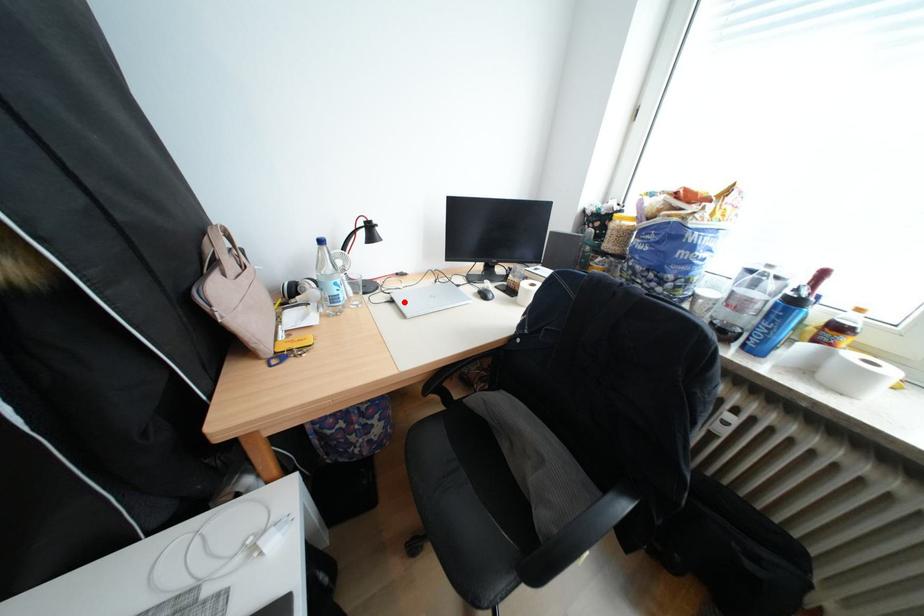
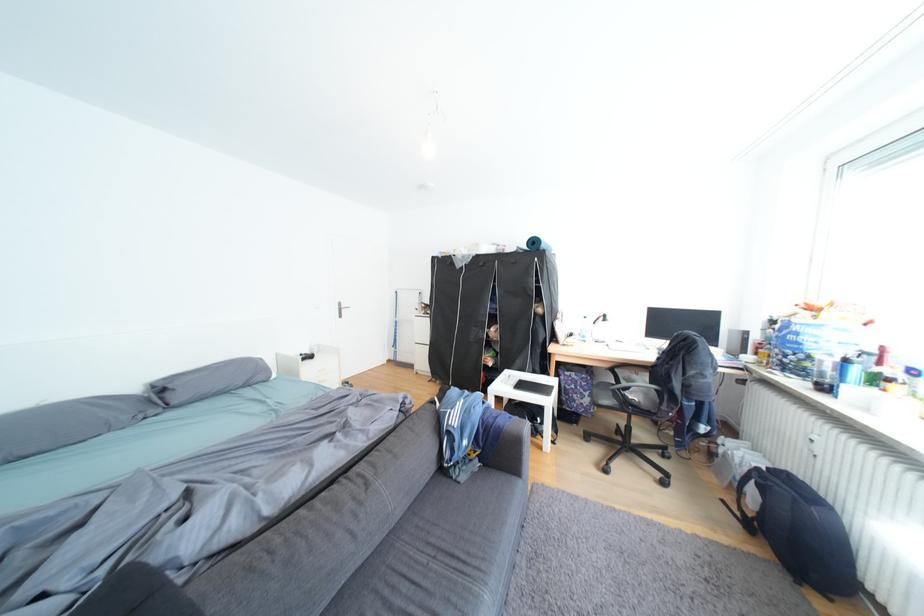
Question: I am providing you with two images of the same scene from different viewpoints. A red point is marked on the first image. Is the red point's position out of view in image 2?

Choices:
 (A) Yes
 (B) No

Answer: (A)